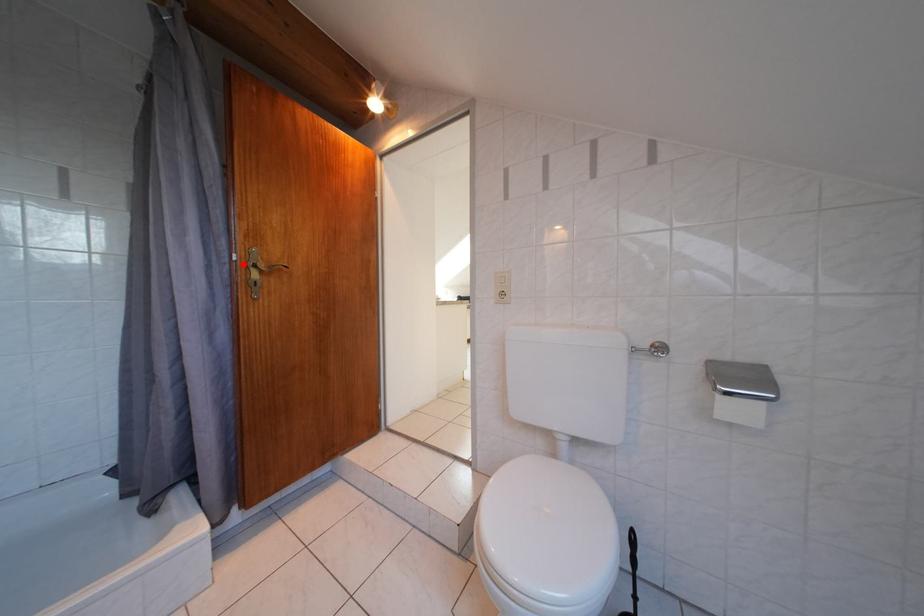
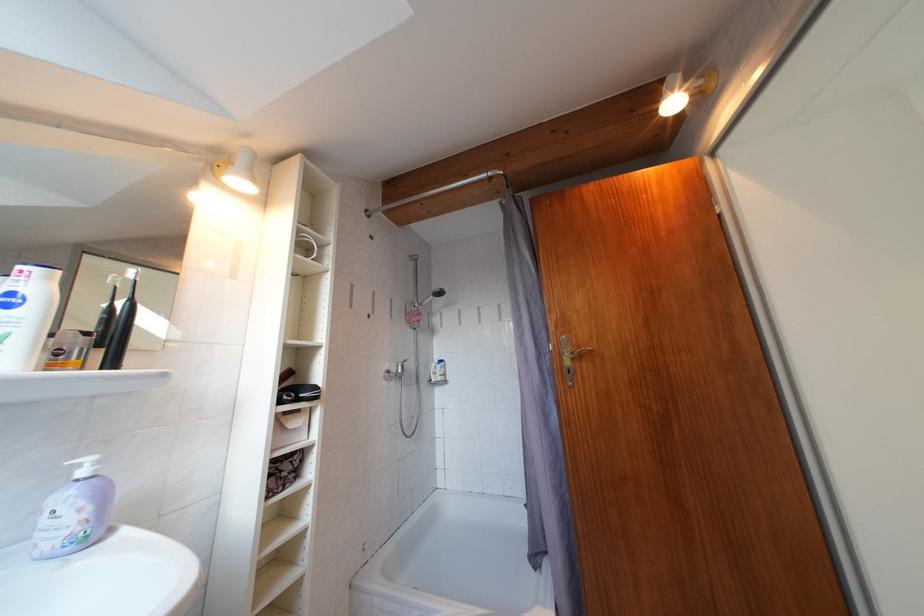
Where in the second image is the point corresponding to the highlighted location from the first image?

(560, 354)